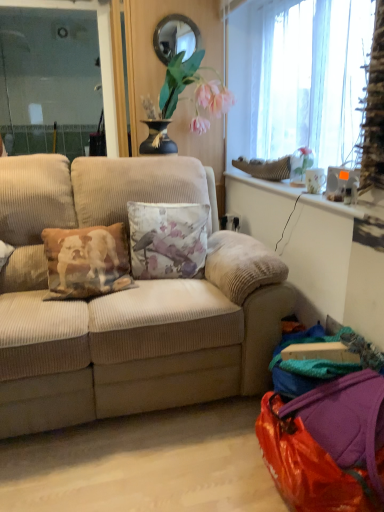
Question: Does floral fabric cushion at center have a greater height compared to shiny orange bag at lower right?

Choices:
 (A) yes
 (B) no

Answer: (A)

Question: Is floral fabric cushion at center directly adjacent to shiny orange bag at lower right?

Choices:
 (A) yes
 (B) no

Answer: (B)

Question: Can you confirm if floral fabric cushion at center is bigger than shiny orange bag at lower right?

Choices:
 (A) no
 (B) yes

Answer: (A)

Question: Does floral fabric cushion at center appear on the right side of shiny orange bag at lower right?

Choices:
 (A) no
 (B) yes

Answer: (A)

Question: From the image's perspective, is floral fabric cushion at center beneath shiny orange bag at lower right?

Choices:
 (A) yes
 (B) no

Answer: (B)

Question: In the image, is beige corduroy couch at center positioned in front of or behind shiny orange bag at lower right?

Choices:
 (A) behind
 (B) front

Answer: (A)

Question: Does point (162, 344) appear closer or farther from the camera than point (380, 415)?

Choices:
 (A) closer
 (B) farther

Answer: (B)

Question: Would you say beige corduroy couch at center is inside or outside shiny orange bag at lower right?

Choices:
 (A) outside
 (B) inside

Answer: (A)

Question: Is beige corduroy couch at center bigger or smaller than shiny orange bag at lower right?

Choices:
 (A) big
 (B) small

Answer: (A)

Question: Considering the positions of point (190, 33) and point (259, 52), is point (190, 33) closer or farther from the camera than point (259, 52)?

Choices:
 (A) closer
 (B) farther

Answer: (A)

Question: In terms of width, does matte glass mirror at upper center look wider or thinner when compared to translucent fabric window at upper right?

Choices:
 (A) thin
 (B) wide

Answer: (A)

Question: In terms of size, does matte glass mirror at upper center appear bigger or smaller than translucent fabric window at upper right?

Choices:
 (A) big
 (B) small

Answer: (B)

Question: From a real-world perspective, is matte glass mirror at upper center positioned above or below translucent fabric window at upper right?

Choices:
 (A) below
 (B) above

Answer: (B)

Question: In the image, is translucent fabric window at upper right positioned in front of or behind floral fabric cushion at center?

Choices:
 (A) front
 (B) behind

Answer: (A)

Question: From a real-world perspective, relative to floral fabric cushion at center, is translucent fabric window at upper right vertically above or below?

Choices:
 (A) above
 (B) below

Answer: (A)